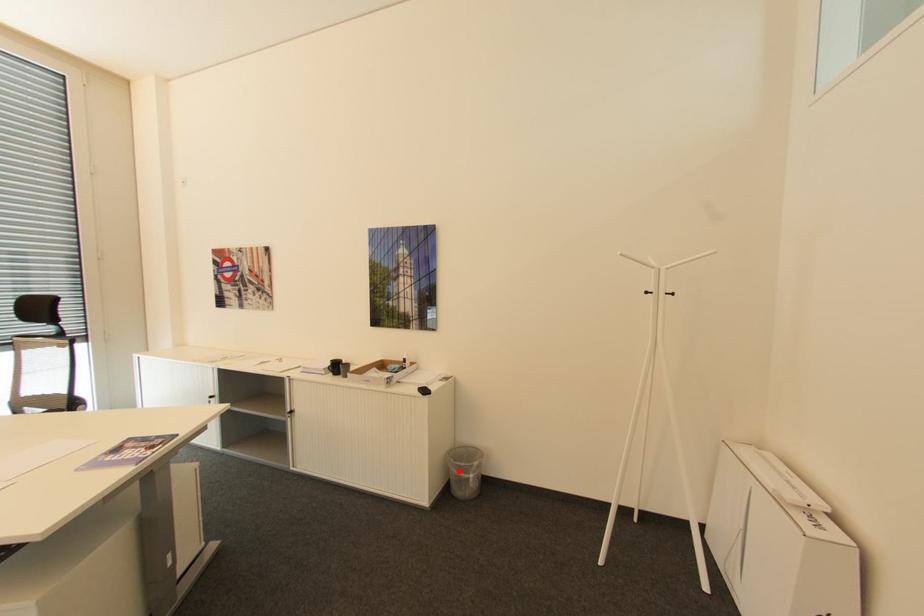
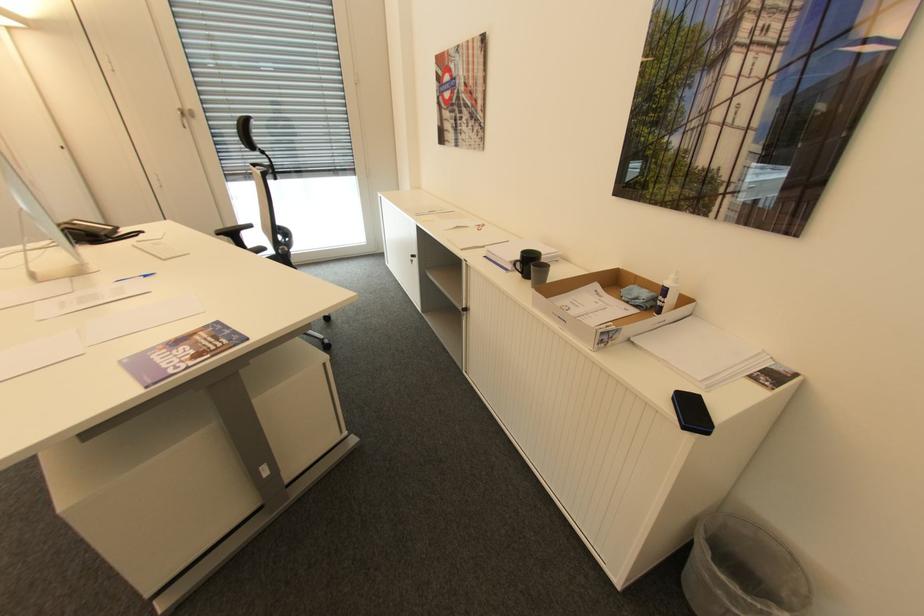
Find the pixel in the second image that matches the highlighted location in the first image.

(711, 576)